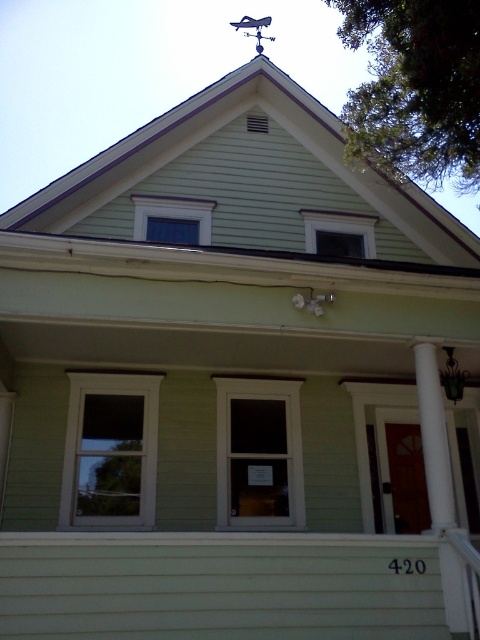
You are a delivery person standing 10 feet away from the house. You need to place a package on the porch. The porch is directly in front of the clear glass window at center. Can you reach the porch without moving closer than 10 feet from the green siding at center?

The green siding at center is 9.76 feet from the clear glass window at center. Since the porch is directly in front of the clear glass window at center, the distance from the delivery person to the porch would be 10 feet minus 9.76 feet, which is 0.24 feet. Therefore, you can reach the porch without moving closer than 10 feet from the green siding at center because the distance is already within the 10 feet limit.

You are standing in front of the house and want to paint the green siding at center. According to the coordinates provided, where exactly should you focus your painting efforts?

The green siding at center is located at point coordinates (232, 420), so you should focus your painting efforts there.